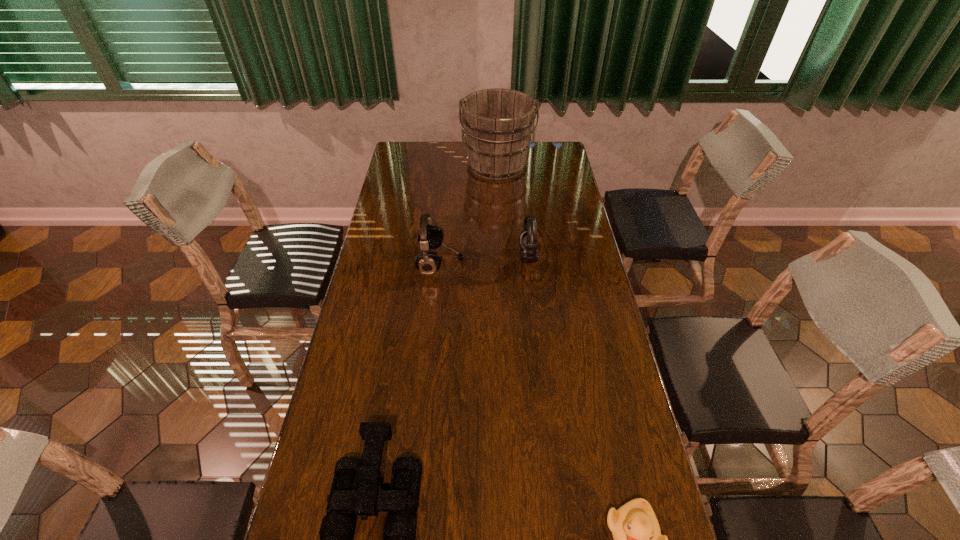
Locate an element on the screen. The image size is (960, 540). object located at the far edge is located at coordinates (497, 122).

This screenshot has height=540, width=960. Find the location of `free space at the far edge of the desktop`. free space at the far edge of the desktop is located at coordinates (444, 154).

Identify the location of vacant space at the left edge. The image size is (960, 540). (384, 356).

Identify the location of free point at the right edge. (x=582, y=434).

Find the location of `free region at the far left corner`. free region at the far left corner is located at coordinates (402, 166).

Find the location of `free space at the far right corner of the desktop`. free space at the far right corner of the desktop is located at coordinates (539, 167).

Locate an element on the screen. The image size is (960, 540). vacant region between the shorter headset and the taller headset is located at coordinates (485, 259).

Locate an element on the screen. This screenshot has height=540, width=960. vacant space that's between the bucket and the shorter headset is located at coordinates (513, 211).

Where is `object that is the second nearest to the shortest object`? object that is the second nearest to the shortest object is located at coordinates (528, 237).

Identify which object is located as the second nearest to the right headset. Please provide its 2D coordinates. Your answer should be formatted as a tuple, i.e. [(x, y)], where the tuple contains the x and y coordinates of a point satisfying the conditions above.

[(497, 122)]